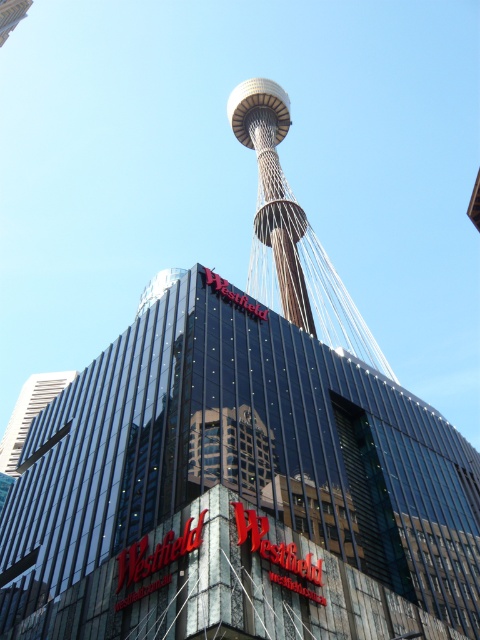
You are standing at the base of the tall cylindrical tower and want to walk towards the two points marked in the image. Which point, point (335, 492) or point (304, 291), would you reach first?

Point (335, 492) is in front of point (304, 291), so you would reach point (335, 492) first.

You are standing in the urban landscape and want to take a photo of both the glassy steel tower at center and the gold metallic tower at center. Which tower should you position to your left to capture both in the frame?

You should position the glassy steel tower at center to your left since it is already to the left of the gold metallic tower at center, allowing both to be captured in the frame.

In the scene shown: You are an architect evaluating the urban landscape. You notice the glassy steel tower at center and the gold metallic tower at center. Which of these two towers is larger in size?

The glassy steel tower at center is bigger than the gold metallic tower at center.